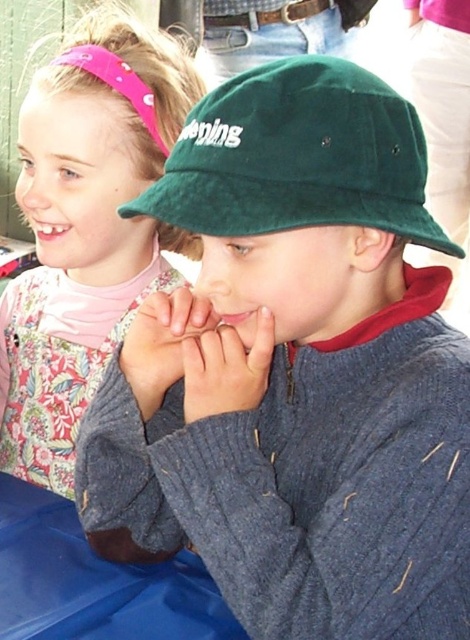
You are standing in front of the image and want to place a sticker exactly at the center of the green velvety hat at center. According to the coordinates provided, where should you place the sticker?

The sticker should be placed at point (x=297, y=157) on the image, as this is the exact location of the green velvety hat at center.

You are a fashion designer looking at the image of two children. You need to determine which pink fabric item is closer to you between the pink fabric headband at upper left and the matte pink fabric at upper left. Which one is closer?

The pink fabric headband at upper left is closer to you than the matte pink fabric at upper left because it is further to the viewer.

You are standing 1 meter away from a point labeled as point (x=131, y=48) in the image. If you want to reach that point without moving your feet, can you do it?

The distance of point (x=131, y=48) from viewer is 85.74 centimeters. Since you are standing 1 meter away, which is farther than the point, you cannot reach it without moving closer. Therefore, you cannot reach the point without moving your feet.